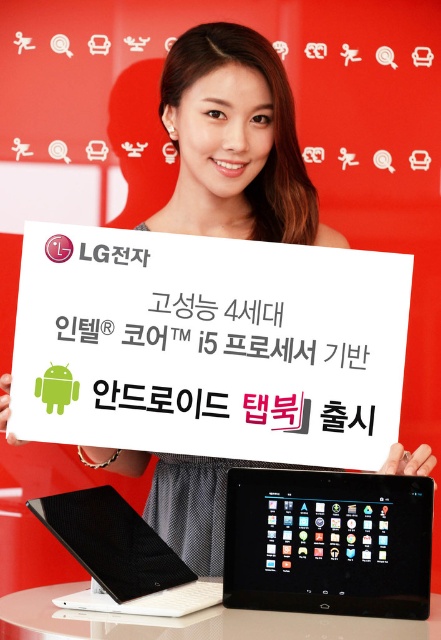
Between black carbon fiber tablet at lower center and white glossy table at lower center, which one appears on the right side from the viewer's perspective?

white glossy table at lower center is more to the right.

Between black carbon fiber tablet at lower center and white glossy table at lower center, which one is positioned higher?

Positioned higher is black carbon fiber tablet at lower center.

Is point (156, 554) more distant than point (4, 632)?

Yes.

You are a GUI agent. You are given a task and a screenshot of the screen. Output one action in this format:
    pyautogui.click(x=<x>, y=<y>)
    Task: Click on the black carbon fiber tablet at lower center
    The width and height of the screenshot is (441, 640).
    Given the screenshot: What is the action you would take?
    pyautogui.click(x=122, y=556)

Does black glossy tablet at center appear on the left side of white glossy table at lower center?

No, black glossy tablet at center is not to the left of white glossy table at lower center.

Which is above, black glossy tablet at center or white glossy table at lower center?

black glossy tablet at center

Where is `black glossy tablet at center`? The height and width of the screenshot is (640, 441). black glossy tablet at center is located at coordinates (328, 541).

The image size is (441, 640). Find the location of `black glossy tablet at center`. black glossy tablet at center is located at coordinates (328, 541).

Which is more to the left, black glossy tablet at center or black carbon fiber tablet at lower center?

black carbon fiber tablet at lower center is more to the left.

Can you confirm if black glossy tablet at center is wider than black carbon fiber tablet at lower center?

Yes, black glossy tablet at center is wider than black carbon fiber tablet at lower center.

In order to click on black glossy tablet at center in this screenshot , I will do `click(328, 541)`.

At what (x,y) coordinates should I click in order to perform the action: click on black glossy tablet at center. Please return your answer as a coordinate pair (x, y). The width and height of the screenshot is (441, 640). Looking at the image, I should click on (328, 541).